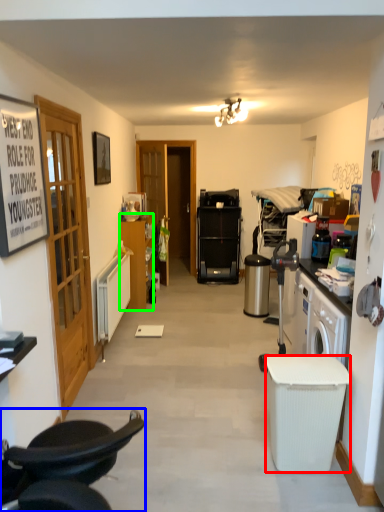
Question: Which object is positioned farthest from trash bin/can (highlighted by a red box)? Select from chair (highlighted by a blue box) and cabinetry (highlighted by a green box).

Choices:
 (A) chair
 (B) cabinetry

Answer: (B)